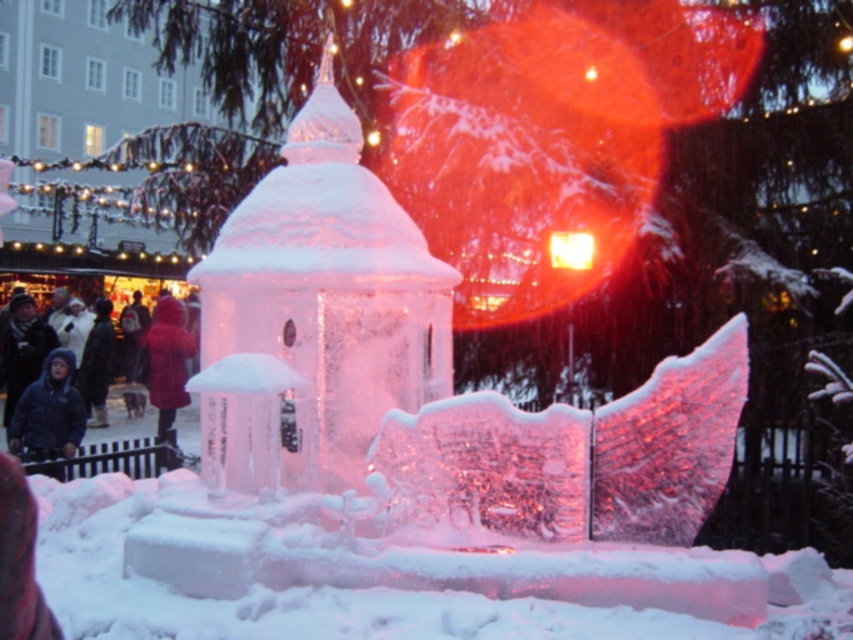
You are at a winter market and see two jackets hanging on a rack. The black fuzzy jacket at lower left and the blue woolen jacket at lower left. Which jacket is positioned higher on the rack?

The black fuzzy jacket at lower left is above the blue woolen jacket at lower left, so the black fuzzy jacket at lower left is positioned higher on the rack.

You are standing at the entrance of the Christmas market and see the icy white snow at center and the blue woolen jacket at lower left. Which object is closer to you?

The icy white snow at center is closer to you because it is in front of the blue woolen jacket at lower left.

You are standing at the position of the camera, looking at the ice sculpture. Which of the two points, point (311, 605) or point (83, 356), is nearer to you?

Point (311, 605) is closer to the camera than point (83, 356).